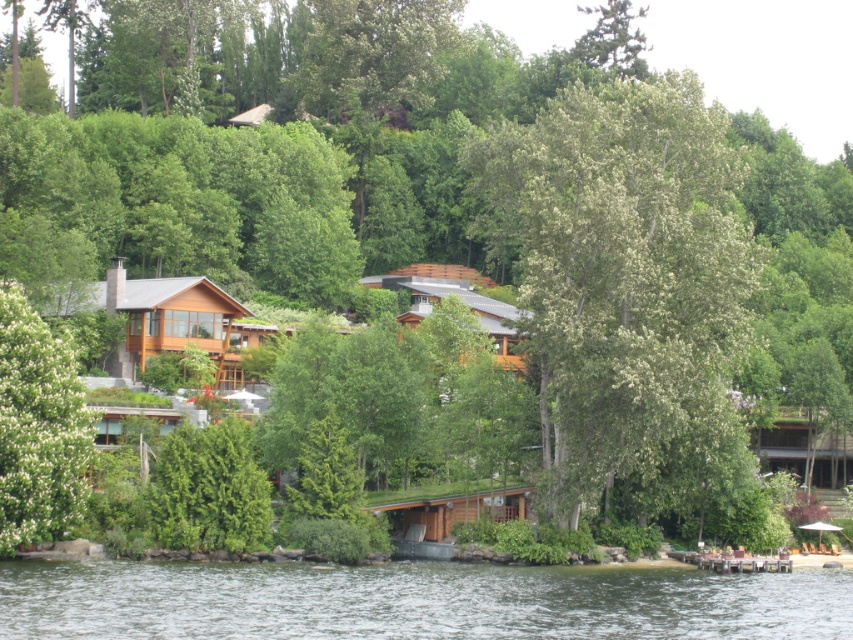
You are standing at the lakeside and want to walk from point A to point B. Point A is at coordinates point (x=274, y=580), and point B is at coordinates point (x=44, y=372). According to the scene, which direction should you head to reach point B from point A?

To reach point B from point A, you should head towards the lower right direction since point (x=274, y=580) is in front of point (x=44, y=372).

You are standing at the center of the lakeside scene. Which direction should you look to see the green leafy tree at left?

You should look to your left to see the green leafy tree at left, as it is positioned at the left side of the scene.

Looking at this image, you are standing in the lakeside area and see the green leafy tree at center and the green leafy tree at left. Which tree is closer to your left side?

The green leafy tree at left is closer to your left side because it is positioned to the left of the green leafy tree at center.